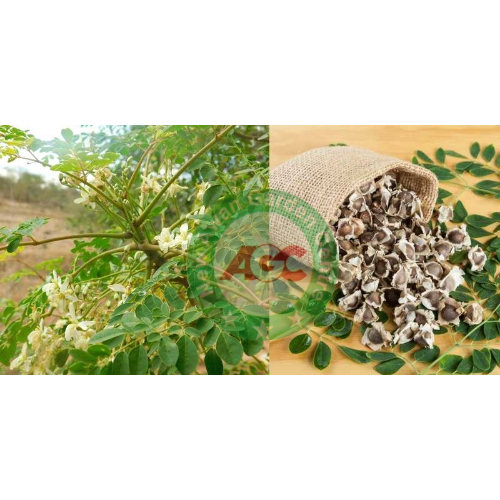
Where is `table under the burlap fabric, dried flowers and leaves`? table under the burlap fabric, dried flowers and leaves is located at coordinates (282, 138), (379, 137), (458, 137), (477, 203), (407, 372), (338, 369), (280, 366).